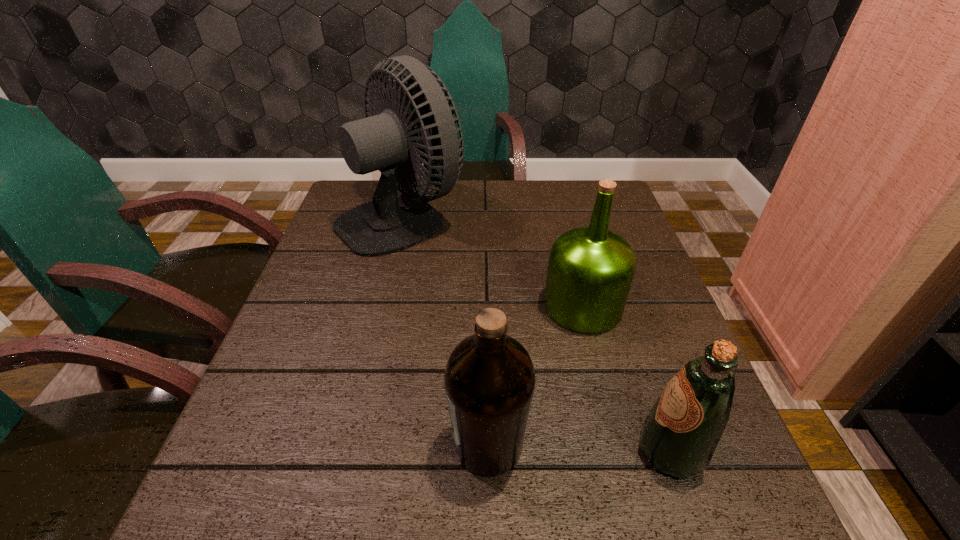
Find the location of `vacant space that satisfies the following two spatial constraints: 1. in front of the farthest object to direct airflow; 2. on the back side of the third nearest object`. vacant space that satisfies the following two spatial constraints: 1. in front of the farthest object to direct airflow; 2. on the back side of the third nearest object is located at coordinates (381, 306).